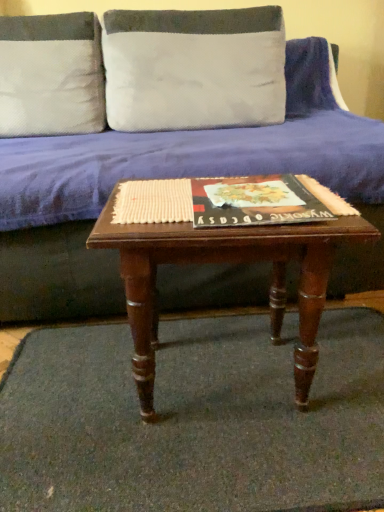
Question: Is white textured pillow at upper center, placed as the first pillow when sorted from right to left, taller or shorter than mahogany wood coffee table at center?

Choices:
 (A) short
 (B) tall

Answer: (A)

Question: Which is correct: white textured pillow at upper center, placed as the first pillow when sorted from right to left, is inside mahogany wood coffee table at center, or outside of it?

Choices:
 (A) outside
 (B) inside

Answer: (A)

Question: Which of these objects is positioned farthest from the green carpet at center?

Choices:
 (A) white textured pillow at upper center, placed as the first pillow when sorted from right to left
 (B) matte black book at center
 (C) blue fabric couch at center
 (D) white textured pillow at upper left, the 2th pillow from the right
 (E) mahogany wood coffee table at center

Answer: (D)

Question: Which of these objects is positioned farthest from the white textured pillow at upper center, placed as the 2th pillow when sorted from left to right?

Choices:
 (A) matte black book at center
 (B) white textured pillow at upper left, the 2th pillow from the right
 (C) green carpet at center
 (D) mahogany wood coffee table at center
 (E) blue fabric couch at center

Answer: (C)